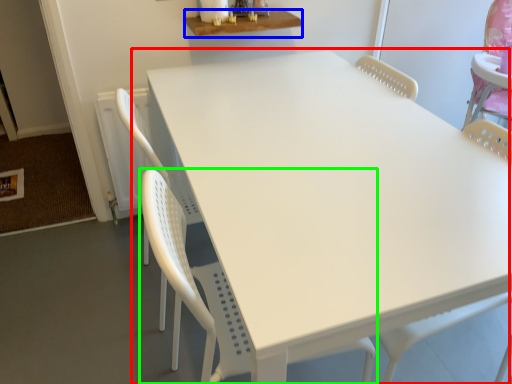
Question: Which object is positioned farthest from table (highlighted by a red box)? Select from table (highlighted by a blue box) and chair (highlighted by a green box).

Choices:
 (A) table
 (B) chair

Answer: (A)